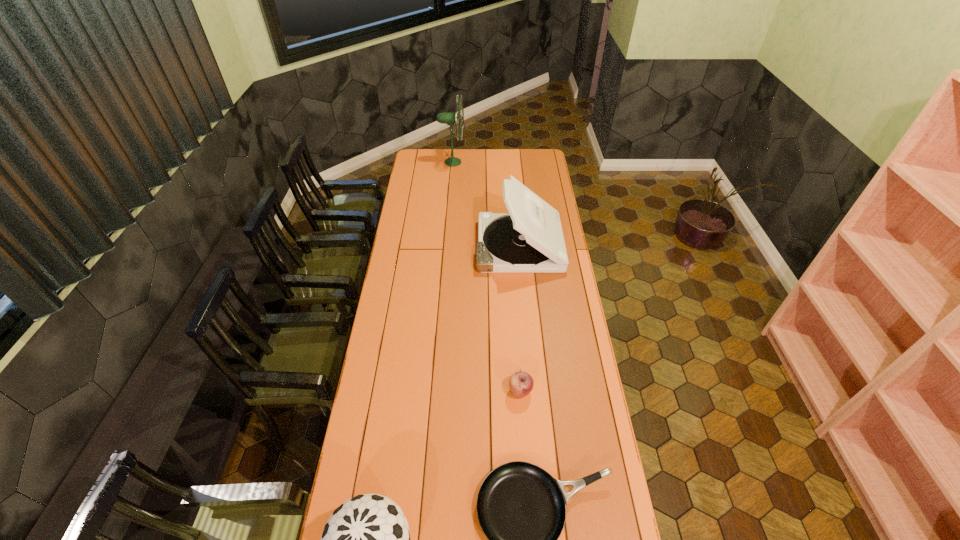
Where is `free location located on the left of the fourth tallest object`? The image size is (960, 540). free location located on the left of the fourth tallest object is located at coordinates (492, 391).

At what (x,y) coordinates should I click in order to perform the action: click on object that is at the far edge. Please return your answer as a coordinate pair (x, y). This screenshot has height=540, width=960. Looking at the image, I should click on (447, 118).

This screenshot has height=540, width=960. I want to click on object that is at the right edge, so click(530, 240).

At what (x,y) coordinates should I click in order to perform the action: click on blank space at the far edge. Please return your answer as a coordinate pair (x, y). Looking at the image, I should click on (476, 153).

Identify the location of vacant space at the left edge. (397, 481).

Find the location of a particular element. Image resolution: width=960 pixels, height=540 pixels. free region at the right edge of the desktop is located at coordinates (565, 313).

In order to click on free region at the far left corner of the desktop in this screenshot , I will do `click(428, 158)`.

You are a GUI agent. You are given a task and a screenshot of the screen. Output one action in this format:
    pyautogui.click(x=<x>, y=<y>)
    Task: Click on the free spot between the fourth nearest object and the tallest object
    Image resolution: width=960 pixels, height=540 pixels.
    Given the screenshot: What is the action you would take?
    pyautogui.click(x=486, y=204)

Where is `vacant area that lies between the tallest object and the apple`? vacant area that lies between the tallest object and the apple is located at coordinates (487, 276).

This screenshot has width=960, height=540. Find the location of `object that ranks as the closest to the third farthest object`. object that ranks as the closest to the third farthest object is located at coordinates (521, 508).